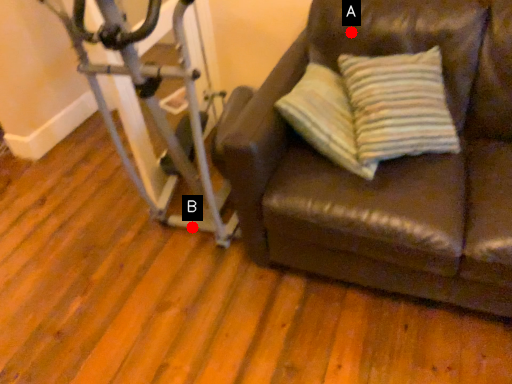
Question: Two points are circled on the image, labeled by A and B beside each circle. Among these points, which one is nearest to the camera?

Choices:
 (A) A is closer
 (B) B is closer

Answer: (A)